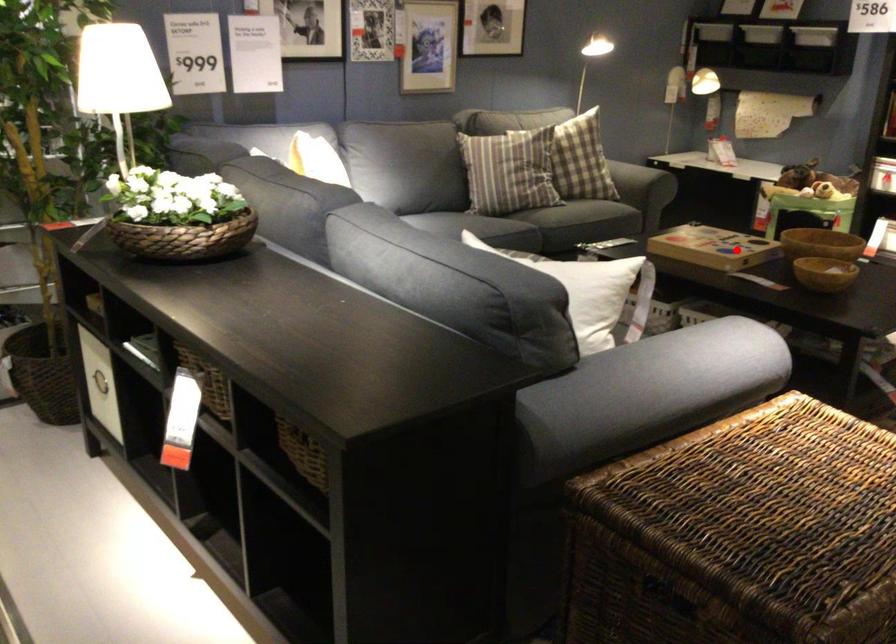
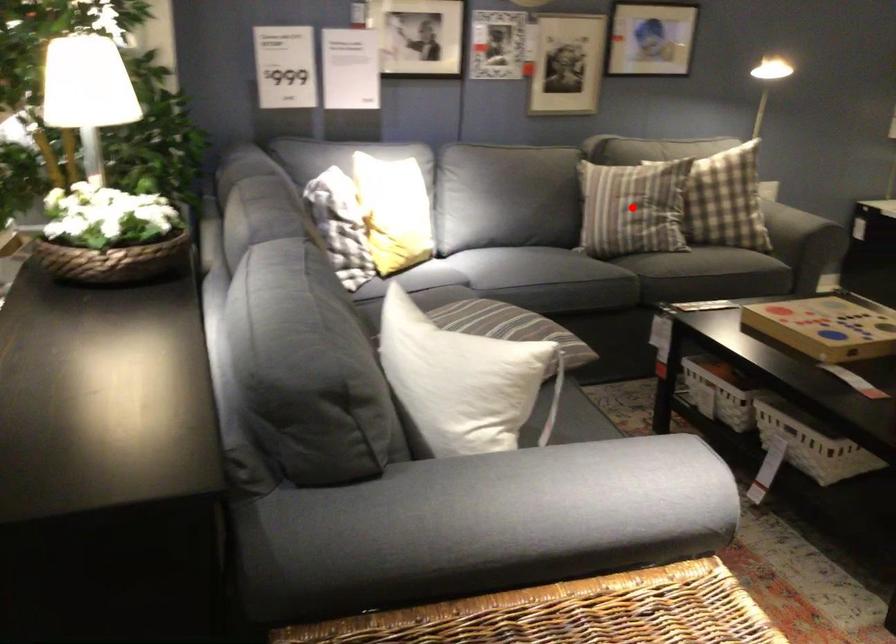
I am providing you with two images of the same scene from different viewpoints. A red point is marked on the first image and another point is marked on the second image. Is the marked point in image1 the same physical position as the marked point in image2?

No